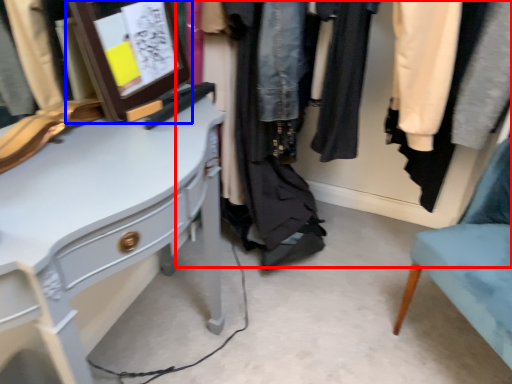
Question: Which point is closer to the camera, closet (highlighted by a red box) or picture frame (highlighted by a blue box)?

Choices:
 (A) closet
 (B) picture frame

Answer: (B)